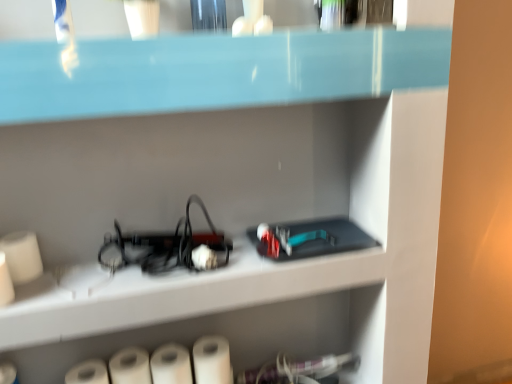
Question: From a real-world perspective, is white matte paper towel at lower center, marked as the 4th paper towel in a left-to-right arrangement, positioned above or below white matte paper towel at lower center, acting as the 3th paper towel starting from the left?

Choices:
 (A) below
 (B) above

Answer: (B)

Question: Considering the positions of white matte paper towel at lower center, which is the 1th paper towel in right-to-left order, and white matte paper towel at lower center, acting as the 3th paper towel starting from the left, in the image, is white matte paper towel at lower center, which is the 1th paper towel in right-to-left order, taller or shorter than white matte paper towel at lower center, acting as the 3th paper towel starting from the left,?

Choices:
 (A) short
 (B) tall

Answer: (B)

Question: Which object is the farthest from the white matte paper towel at lower left, arranged as the second paper towel when viewed from the left?

Choices:
 (A) white matte paper towel at lower left, which is the 1th paper towel in left-to-right order
 (B) white matte paper towel at lower center, acting as the 3th paper towel starting from the left
 (C) white matte paper towel at lower center, marked as the 4th paper towel in a left-to-right arrangement

Answer: (C)

Question: Which object is positioned closest to the white matte paper towel at lower left, which is the 1th paper towel in left-to-right order?

Choices:
 (A) white matte paper towel at lower center, which is the 1th paper towel in right-to-left order
 (B) white matte paper towel at lower left, the 3th paper towel when ordered from right to left
 (C) white matte paper towel at lower center, the 2th paper towel positioned from the right

Answer: (B)